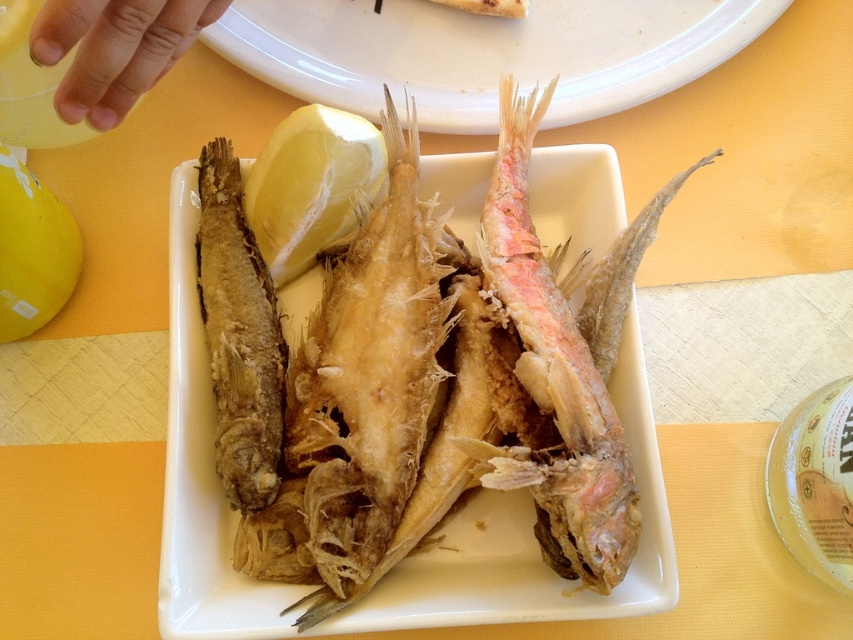
You are a food delivery person who needs to place a hot pad between the golden crispy fish at center and the yellow matte lemon at center on the plate to prevent burning the table. The hot pad is 6 inches wide. Do you think the space between them is sufficient to fit the hot pad?

The distance between the golden crispy fish at center and the yellow matte lemon at center is 5.83 inches. Since the hot pad is 6 inches wide, it is slightly too wide to fit in the available space.

You are looking at the plate of fried fish and notice two points on the tablecloth. Which point is closer to you, point (677, 32) or point (547, 406)?

Point (677, 32) is closer to you than point (547, 406).